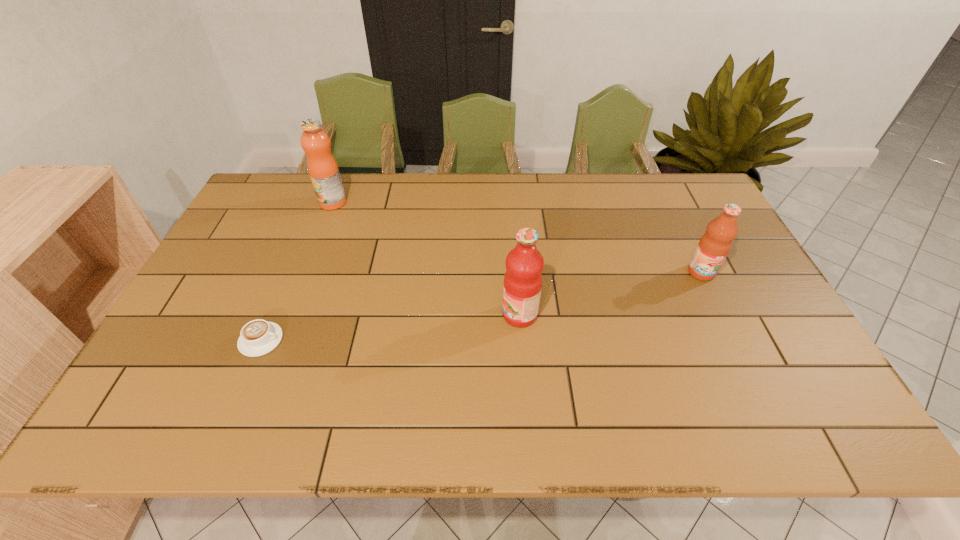
Locate an element on the screen. This screenshot has height=540, width=960. the farthest object is located at coordinates (322, 167).

Identify the location of the leftmost fruit juice. This screenshot has height=540, width=960. (322, 167).

I want to click on the second object from right to left, so click(524, 264).

At what (x,y) coordinates should I click in order to perform the action: click on the second fruit juice from left to right. Please return your answer as a coordinate pair (x, y). This screenshot has width=960, height=540. Looking at the image, I should click on click(524, 264).

The height and width of the screenshot is (540, 960). What are the coordinates of `the third nearest object` in the screenshot? It's located at tap(713, 247).

Locate an element on the screen. This screenshot has width=960, height=540. the third tallest object is located at coordinates (713, 247).

Identify the location of cappuccino. 258,337.

Identify the location of free point located 0.060m on the right of the farthest object. (365, 202).

Locate an element on the screen. vacant space located 0.190m on the front label of the third object from left to right is located at coordinates (428, 315).

Identify the location of vacant region located 0.080m on the front label of the third object from left to right. The image size is (960, 540). 471,315.